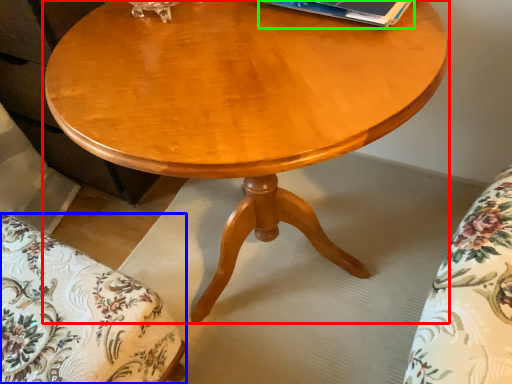
Question: Which is nearer to the coffee table (highlighted by a red box)? swivel chair (highlighted by a blue box) or paperback book (highlighted by a green box).

Choices:
 (A) swivel chair
 (B) paperback book

Answer: (B)